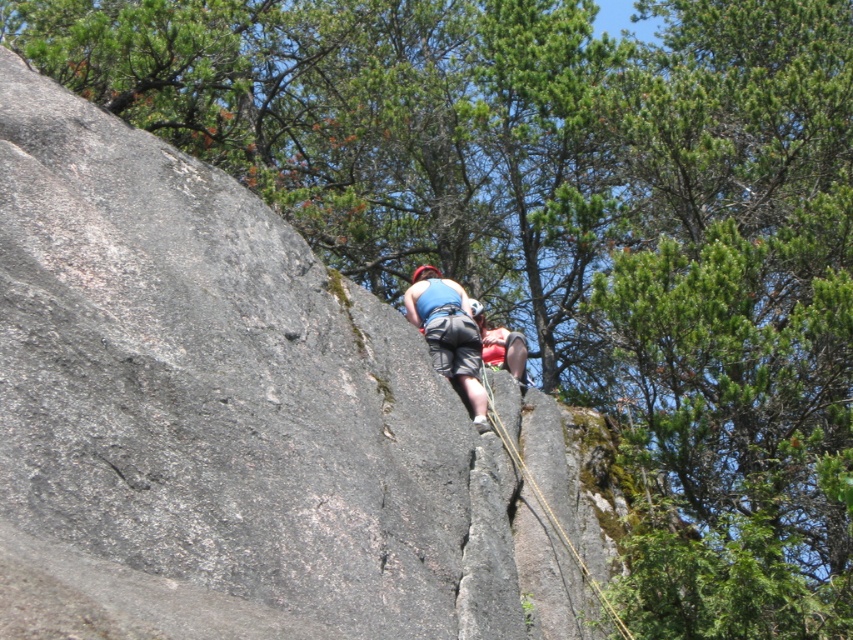
Between blue fabric harness at center and yellow rope at center, which one appears on the right side from the viewer's perspective?

yellow rope at center

The height and width of the screenshot is (640, 853). Describe the element at coordinates (448, 333) in the screenshot. I see `blue fabric harness at center` at that location.

Between point (438, 346) and point (531, 483), which one is positioned behind?

The point (438, 346) is more distant.

Where is `blue fabric harness at center`? The height and width of the screenshot is (640, 853). blue fabric harness at center is located at coordinates (448, 333).